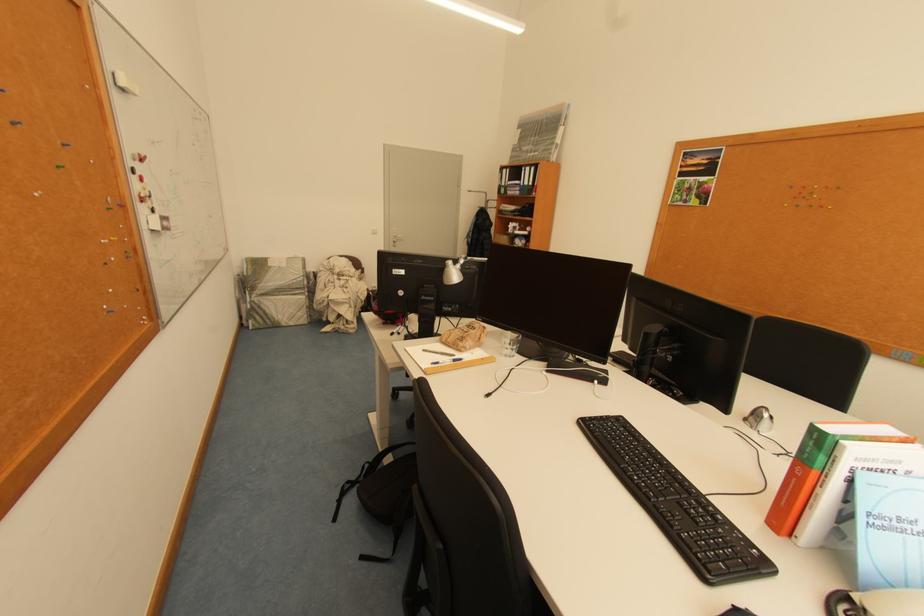
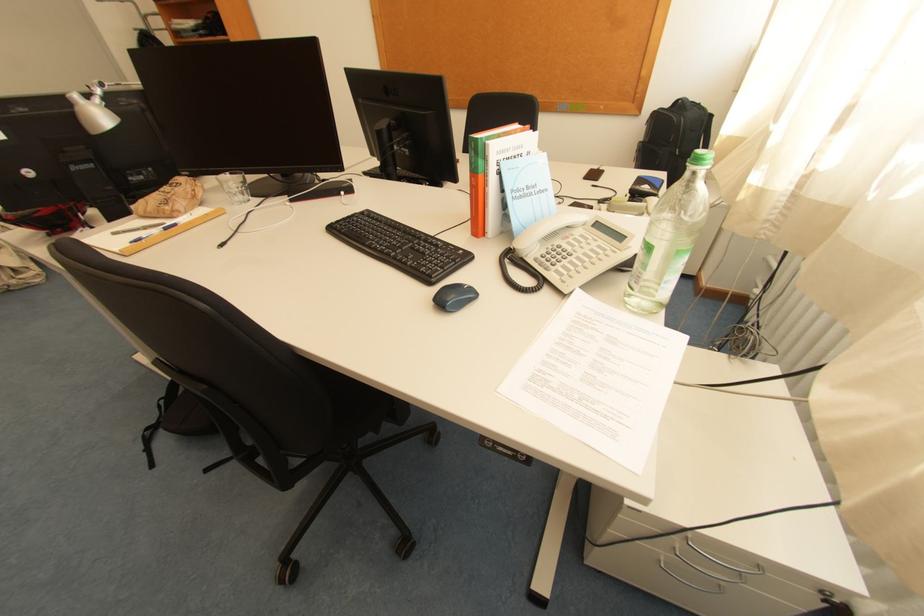
The point at [473,259] is marked in the first image. Where is the corresponding point in the second image?

(110, 86)